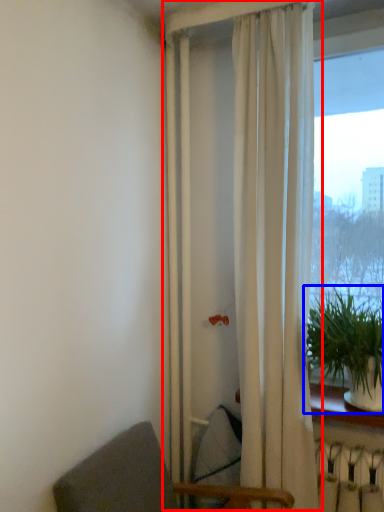
Question: Among these objects, which one is nearest to the camera, curtain (highlighted by a red box) or houseplant (highlighted by a blue box)?

Choices:
 (A) curtain
 (B) houseplant

Answer: (B)